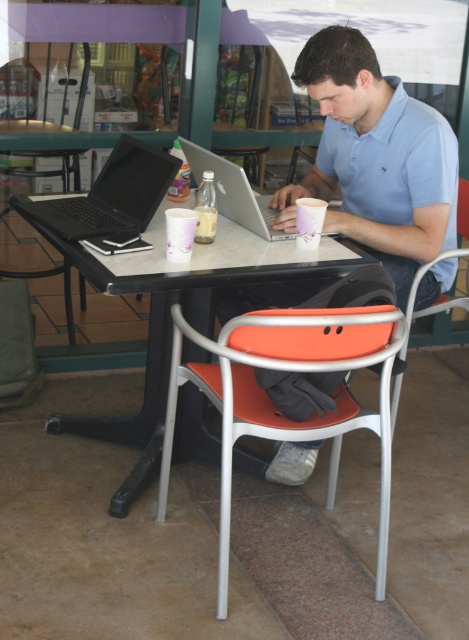
Who is more distant from viewer, (143, 157) or (257, 216)?

Positioned behind is point (143, 157).

Is matte black laptop at left to the right of silver metallic laptop at center from the viewer's perspective?

Incorrect, matte black laptop at left is not on the right side of silver metallic laptop at center.

Is point (149, 212) positioned in front of point (221, 192)?

Yes, point (149, 212) is closer to viewer.

At what (x,y) coordinates should I click in order to perform the action: click on matte black laptop at left. Please return your answer as a coordinate pair (x, y). The width and height of the screenshot is (469, 640). Looking at the image, I should click on (112, 195).

Is orange matte chair at center shorter than white paper cup at center?

No, orange matte chair at center is not shorter than white paper cup at center.

Is point (383, 316) farther from viewer compared to point (195, 209)?

No, (383, 316) is closer to viewer.

This screenshot has height=640, width=469. I want to click on orange matte chair at center, so click(272, 404).

Is light blue cotton shirt at upper center positioned before silver metallic laptop at center?

No, light blue cotton shirt at upper center is behind silver metallic laptop at center.

Where is `light blue cotton shirt at upper center`? light blue cotton shirt at upper center is located at coordinates (375, 157).